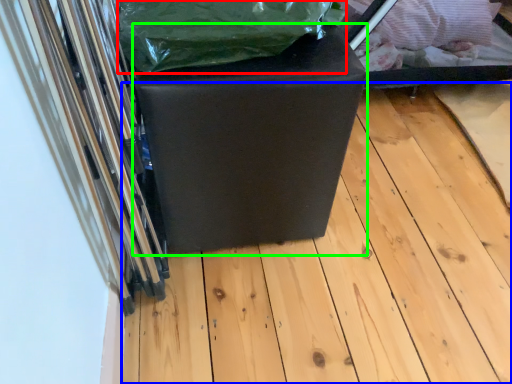
Question: Considering the real-world distances, which object is farthest from waste (highlighted by a red box)? wood (highlighted by a blue box) or furniture (highlighted by a green box)?

Choices:
 (A) wood
 (B) furniture

Answer: (A)